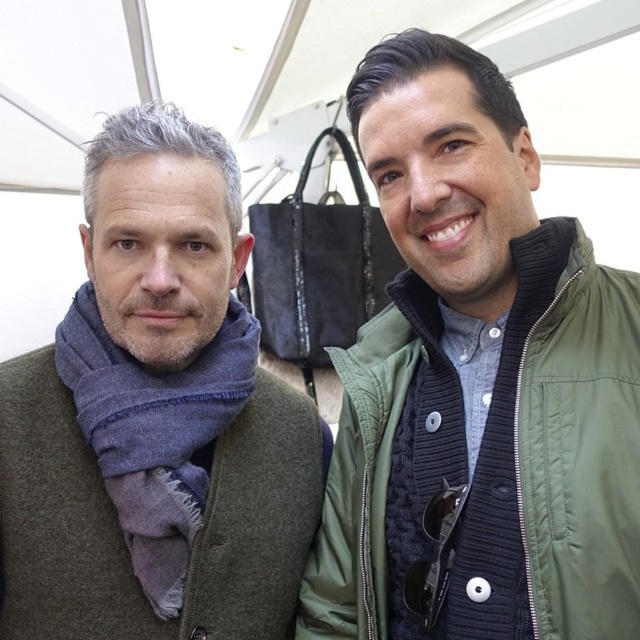
Does point (604, 544) come closer to viewer compared to point (176, 216)?

Yes.

Who is taller, green matte jacket at center or blue wool scarf at left?

green matte jacket at center

Describe the element at coordinates (477, 380) in the screenshot. I see `green matte jacket at center` at that location.

Where is `green matte jacket at center`? The height and width of the screenshot is (640, 640). green matte jacket at center is located at coordinates (477, 380).

Is green matte jacket at center in front of blue woolen scarf at left?

Yes.

Is green matte jacket at center to the right of blue woolen scarf at left from the viewer's perspective?

Correct, you'll find green matte jacket at center to the right of blue woolen scarf at left.

Describe the element at coordinates (477, 380) in the screenshot. I see `green matte jacket at center` at that location.

At what (x,y) coordinates should I click in order to perform the action: click on green matte jacket at center. Please return your answer as a coordinate pair (x, y). Looking at the image, I should click on (477, 380).

Is blue wool scarf at left above blue woolen scarf at left?

Indeed, blue wool scarf at left is positioned over blue woolen scarf at left.

Can you confirm if blue wool scarf at left is bigger than blue woolen scarf at left?

Indeed, blue wool scarf at left has a larger size compared to blue woolen scarf at left.

Is point (72, 637) in front of point (81, 323)?

Yes, point (72, 637) is in front of point (81, 323).

This screenshot has width=640, height=640. In order to click on blue wool scarf at left in this screenshot , I will do `click(154, 413)`.